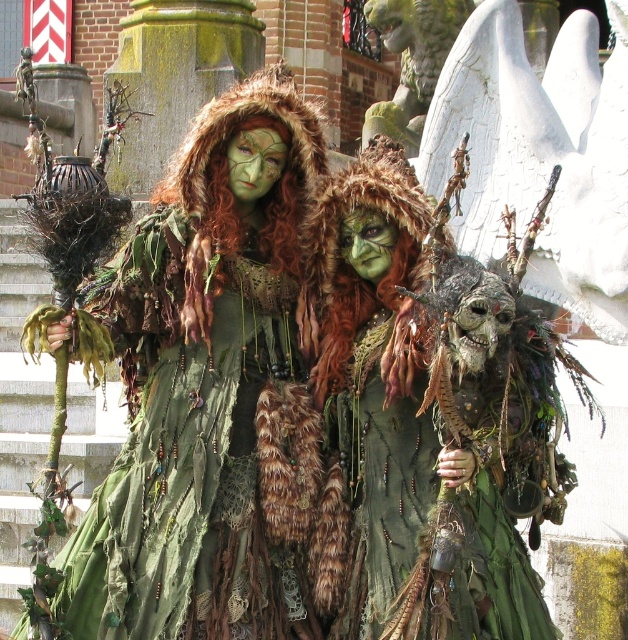
You are a photographer standing 30 meters away from the green matte fur coat at center. Can you safely approach the coat to take a closer photo without exceeding the recommended 3 meters distance limit?

The green matte fur coat at center is 32.72 meters away from the camera. Since you are already 30 meters away, you can approach it by 2.72 meters, which is within the recommended 3 meters distance limit. Therefore, you can safely approach for a closer photo.